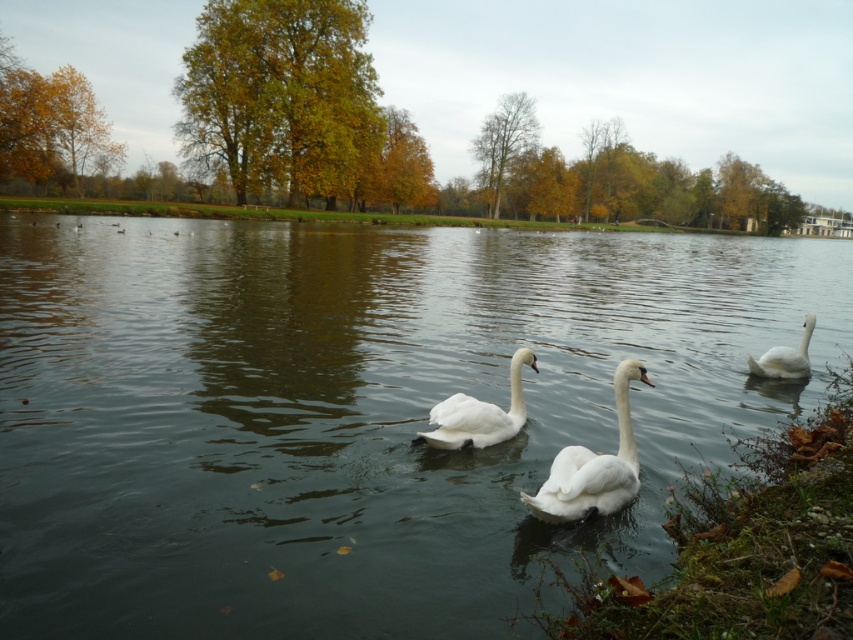
Question: Which object is farther from the camera taking this photo?

Choices:
 (A) clear water at center
 (B) white smooth swan at center

Answer: (B)

Question: Can you confirm if clear water at center is smaller than white glossy swan at right?

Choices:
 (A) yes
 (B) no

Answer: (B)

Question: Does white matte swan at center have a smaller size compared to white glossy swan at right?

Choices:
 (A) yes
 (B) no

Answer: (B)

Question: Where is clear water at center located in relation to white smooth swan at center in the image?

Choices:
 (A) below
 (B) above

Answer: (B)

Question: Among these points, which one is nearest to the camera?

Choices:
 (A) click(x=643, y=372)
 (B) click(x=782, y=353)
 (C) click(x=450, y=278)

Answer: (A)

Question: Which of the following is the closest to the observer?

Choices:
 (A) (799, 358)
 (B) (534, 362)
 (C) (630, 449)

Answer: (C)